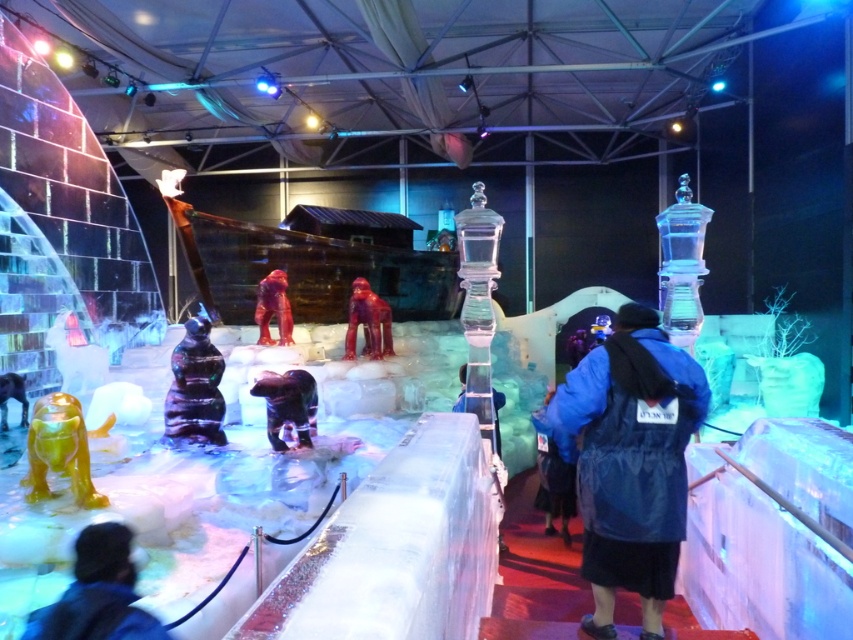
Which is above, glossy purple statue at center or shiny green ice sculpture at lower left?

glossy purple statue at center is higher up.

Find the location of a particular element. The width and height of the screenshot is (853, 640). glossy purple statue at center is located at coordinates (195, 387).

Which is behind, point (202, 403) or point (44, 429)?

The point (202, 403) is more distant.

Locate an element on the screen. glossy purple statue at center is located at coordinates (195, 387).

Does blue fabric backpack at center lie behind glossy red statue at center?

No, it is not.

Is blue fabric backpack at center wider than glossy red statue at center?

No.

Who is more distant from viewer, (x=560, y=461) or (x=347, y=317)?

The point (x=347, y=317) is behind.

Find the location of a particular element. blue fabric backpack at center is located at coordinates (554, 474).

Between blue fabric jacket at lower left and rubber-like red gorilla at center, which one is positioned higher?

rubber-like red gorilla at center is above.

Does blue fabric jacket at lower left have a smaller size compared to rubber-like red gorilla at center?

Yes, blue fabric jacket at lower left is smaller than rubber-like red gorilla at center.

Which is behind, point (100, 632) or point (256, 304)?

The point (256, 304) is more distant.

Locate an element on the screen. This screenshot has width=853, height=640. blue fabric jacket at lower left is located at coordinates (97, 593).